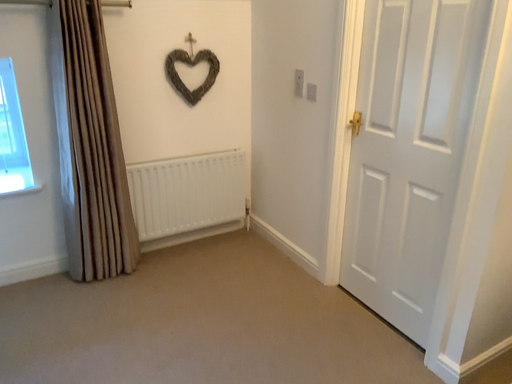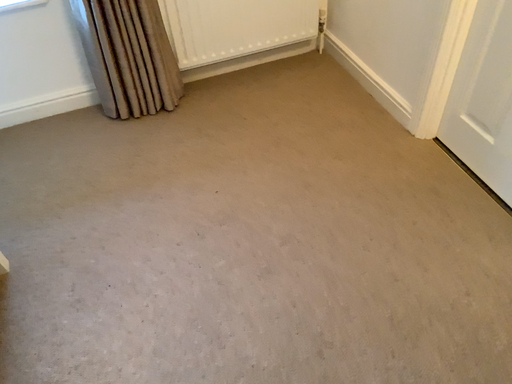
Question: Which way did the camera rotate in the video?

Choices:
 (A) rotated right
 (B) rotated left

Answer: (B)